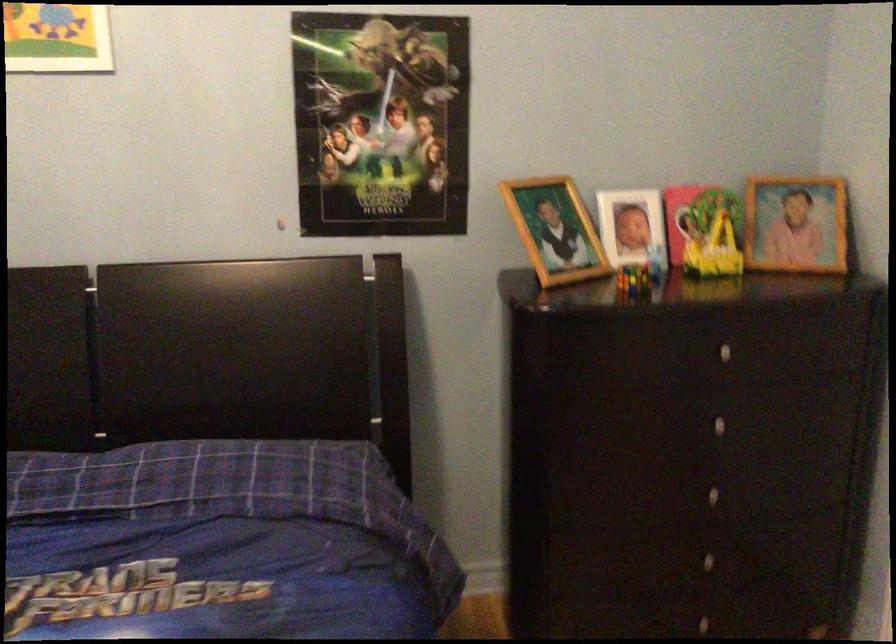
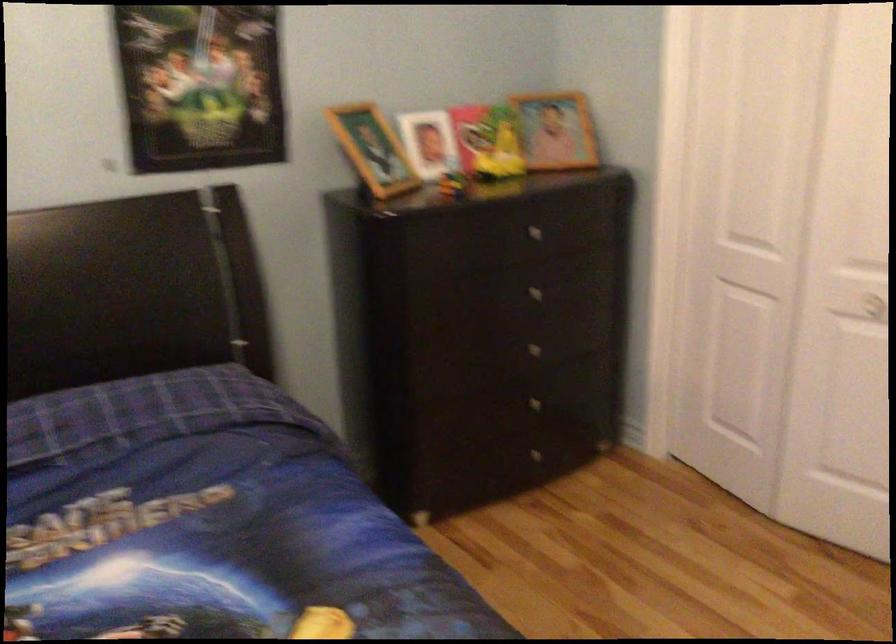
In the second image, find the point that corresponds to point 702,234 in the first image.

(487, 142)